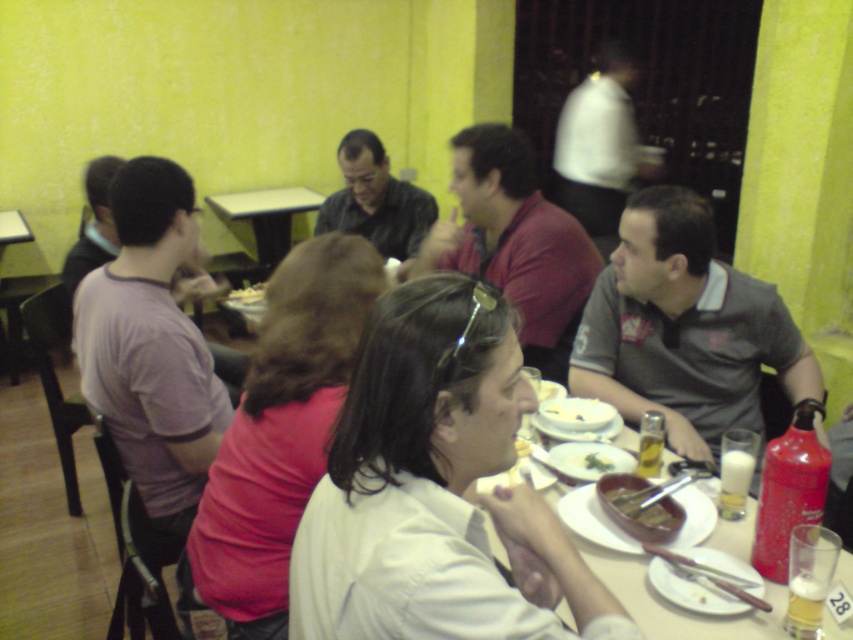
You are a waiter at the restaurant and need to place a new dish on the table. The dish is wider than the matte black shirt at center. Can you fit it next to the green leafy salad at center without moving any other items?

The matte black shirt at center is wider than the green leafy salad at center. Since the new dish is wider than the matte black shirt at center, it would be too large to fit next to the green leafy salad at center without moving other items.

You are a waiter in a restaurant. You see a matte red shirt at center and a white matte plate at center. Which item is covering the other?

The matte red shirt at center is positioned over the white matte plate at center, so the shirt is covering the plate.

You are a waiter in a restaurant and need to place a new dish on the table. You see the matte red shirt at center and the white matte plate at center. Which object should you avoid placing the dish on to ensure it doesn

You should avoid placing the dish on the matte red shirt at center because it is much taller than the white matte plate at center, making it an unstable surface for the dish.